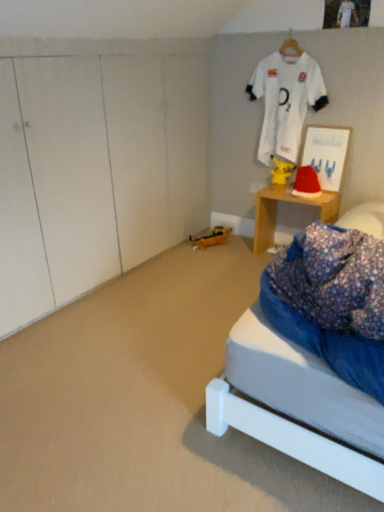
Question: Is wooden desk at right smaller than yellow matte pikachu at center?

Choices:
 (A) no
 (B) yes

Answer: (A)

Question: Considering the relative sizes of wooden desk at right and yellow matte pikachu at center in the image provided, is wooden desk at right bigger than yellow matte pikachu at center?

Choices:
 (A) no
 (B) yes

Answer: (B)

Question: From the image's perspective, would you say wooden desk at right is shown under yellow matte pikachu at center?

Choices:
 (A) no
 (B) yes

Answer: (B)

Question: Is wooden desk at right with yellow matte pikachu at center?

Choices:
 (A) no
 (B) yes

Answer: (A)

Question: Is wooden desk at right completely or partially outside of yellow matte pikachu at center?

Choices:
 (A) yes
 (B) no

Answer: (A)

Question: Is yellow matte pikachu at center at the back of wooden desk at right?

Choices:
 (A) yes
 (B) no

Answer: (B)

Question: Is yellow matte pikachu at center further to camera compared to white jersey at upper center?

Choices:
 (A) no
 (B) yes

Answer: (B)

Question: Is yellow matte pikachu at center completely or partially outside of white jersey at upper center?

Choices:
 (A) no
 (B) yes

Answer: (A)

Question: Considering the relative sizes of yellow matte pikachu at center and white jersey at upper center in the image provided, is yellow matte pikachu at center shorter than white jersey at upper center?

Choices:
 (A) yes
 (B) no

Answer: (A)

Question: Is yellow matte pikachu at center far from white jersey at upper center?

Choices:
 (A) yes
 (B) no

Answer: (B)

Question: From a real-world perspective, is yellow matte pikachu at center over white jersey at upper center?

Choices:
 (A) yes
 (B) no

Answer: (B)

Question: From the image's perspective, does yellow matte pikachu at center appear lower than white jersey at upper center?

Choices:
 (A) yes
 (B) no

Answer: (A)

Question: Is wooden desk at right behind white jersey at upper center?

Choices:
 (A) yes
 (B) no

Answer: (A)